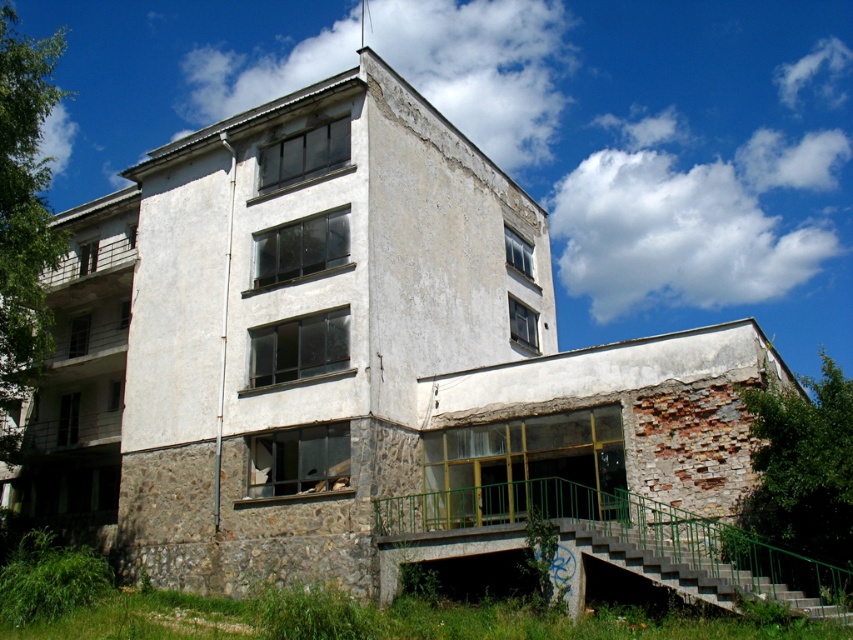
Is green metal railing at lower center positioned in front of concrete stairs at lower right?

No, it is not.

Based on the photo, is green metal railing at lower center wider than concrete stairs at lower right?

Indeed, green metal railing at lower center has a greater width compared to concrete stairs at lower right.

At what (x,y) coordinates should I click in order to perform the action: click on green metal railing at lower center. Please return your answer as a coordinate pair (x, y). The image size is (853, 640). Looking at the image, I should click on (613, 541).